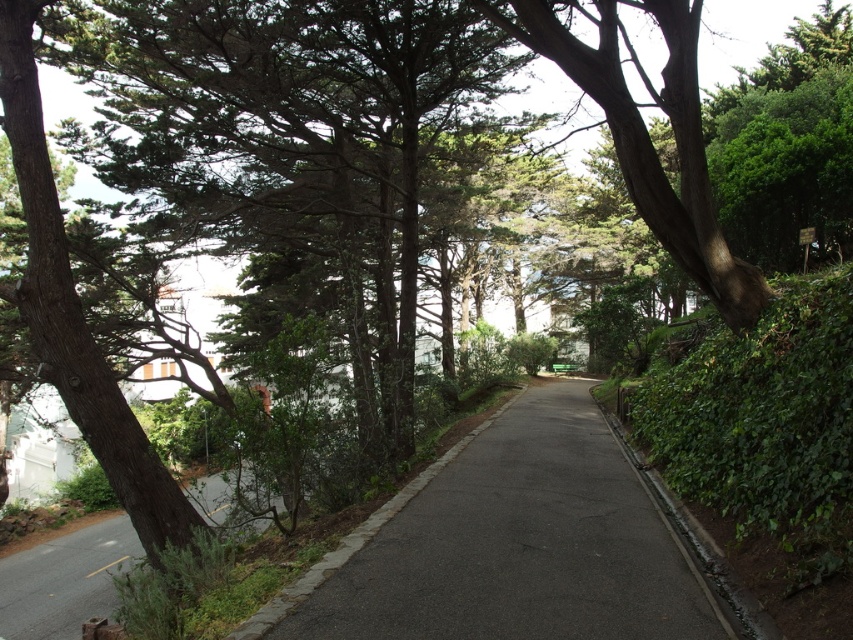
You are a hiker standing on the smooth asphalt road at center. Looking at the smooth brown tree trunk at center, can you see the top of the tree trunk from your position?

The smooth brown tree trunk at center is taller than the smooth asphalt road at center, so yes, you can see the top of the smooth brown tree trunk at center from your position on the road.

You are a delivery person with a cart that is 2 meters wide. You need to navigate through the dark asphalt path at center and the smooth brown tree trunk at center. Can your cart fit between them without touching either?

The dark asphalt path at center is 6.49 meters from the smooth brown tree trunk at center. Since your cart is only 2 meters wide, it can easily fit between them without any issues.